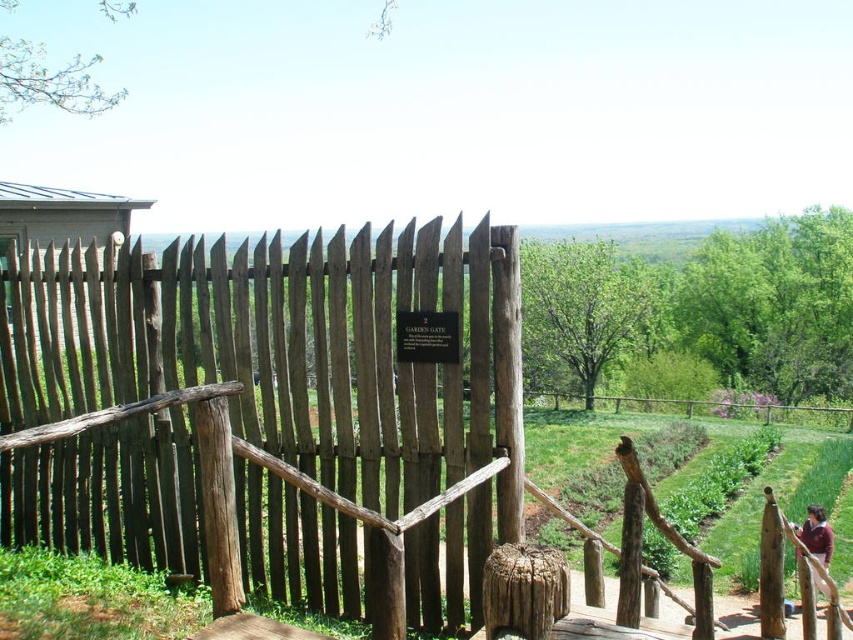
Question: Does gray wooden fence at center appear on the left side of maroon fabric at lower right?

Choices:
 (A) no
 (B) yes

Answer: (B)

Question: Among these objects, which one is farthest from the camera?

Choices:
 (A) gray wooden fence at center
 (B) maroon fabric at lower right

Answer: (B)

Question: Is gray wooden fence at center smaller than maroon fabric at lower right?

Choices:
 (A) yes
 (B) no

Answer: (B)

Question: Does gray wooden fence at center appear under maroon fabric at lower right?

Choices:
 (A) yes
 (B) no

Answer: (B)

Question: Which point is farther to the camera?

Choices:
 (A) gray wooden fence at center
 (B) maroon fabric at lower right

Answer: (B)